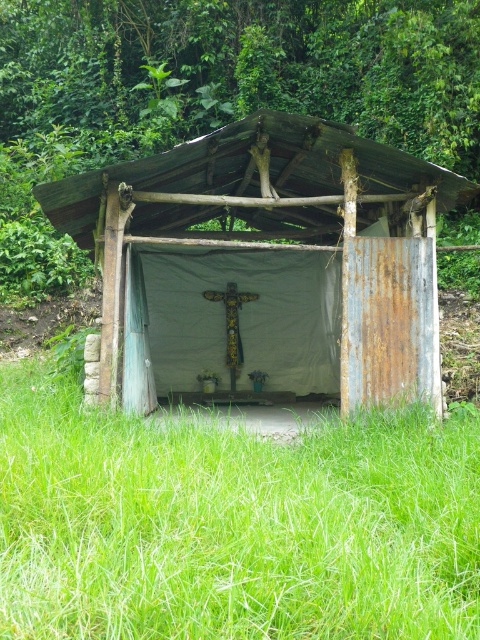
Question: Is green grass at lower center further to camera compared to rusty metal hut at center?

Choices:
 (A) no
 (B) yes

Answer: (A)

Question: Which object appears closest to the camera in this image?

Choices:
 (A) green grass at lower center
 (B) rusty metal hut at center

Answer: (A)

Question: Which of the following is the farthest from the observer?

Choices:
 (A) (331, 280)
 (B) (215, 518)

Answer: (A)

Question: Is green grass at lower center closer to the viewer compared to rusty metal hut at center?

Choices:
 (A) no
 (B) yes

Answer: (B)

Question: Where is green grass at lower center located in relation to rusty metal hut at center in the image?

Choices:
 (A) above
 (B) below

Answer: (B)